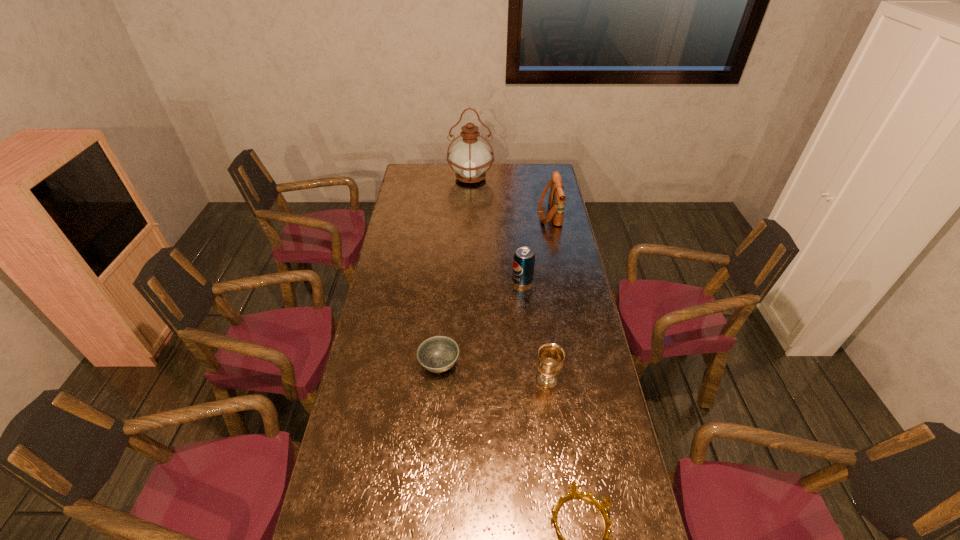
This screenshot has width=960, height=540. What are the coordinates of `vacant space at the far right corner` in the screenshot? It's located at coord(540,176).

You are a GUI agent. You are given a task and a screenshot of the screen. Output one action in this format:
    pyautogui.click(x=<x>, y=<y>)
    Task: Click on the vacant point located between the chalice and the soda can
    The width and height of the screenshot is (960, 540).
    Given the screenshot: What is the action you would take?
    pyautogui.click(x=535, y=330)

Locate an element on the screen. The height and width of the screenshot is (540, 960). vacant area that lies between the chalice and the oil lamp is located at coordinates (509, 279).

Identify the location of empty space between the tallest object and the bowl. (455, 271).

Identify the location of vacant area between the bowl and the fifth nearest object. The image size is (960, 540). (494, 289).

Find the location of a particular element. This screenshot has height=540, width=960. unoccupied position between the soda can and the oil lamp is located at coordinates (496, 230).

Find the location of `empty space between the soda can and the bowl`. empty space between the soda can and the bowl is located at coordinates (481, 322).

Where is `object that stands as the fourth closest to the farthest object`? object that stands as the fourth closest to the farthest object is located at coordinates (550, 360).

Locate which object ranks fourth in proximity to the bowl. Please provide its 2D coordinates. Your answer should be formatted as a tuple, i.e. [(x, y)], where the tuple contains the x and y coordinates of a point satisfying the conditions above.

[(557, 197)]

This screenshot has height=540, width=960. Identify the location of blank area in the image that satisfies the following two spatial constraints: 1. on the back side of the bowl; 2. on the right side of the farthest object. (454, 178).